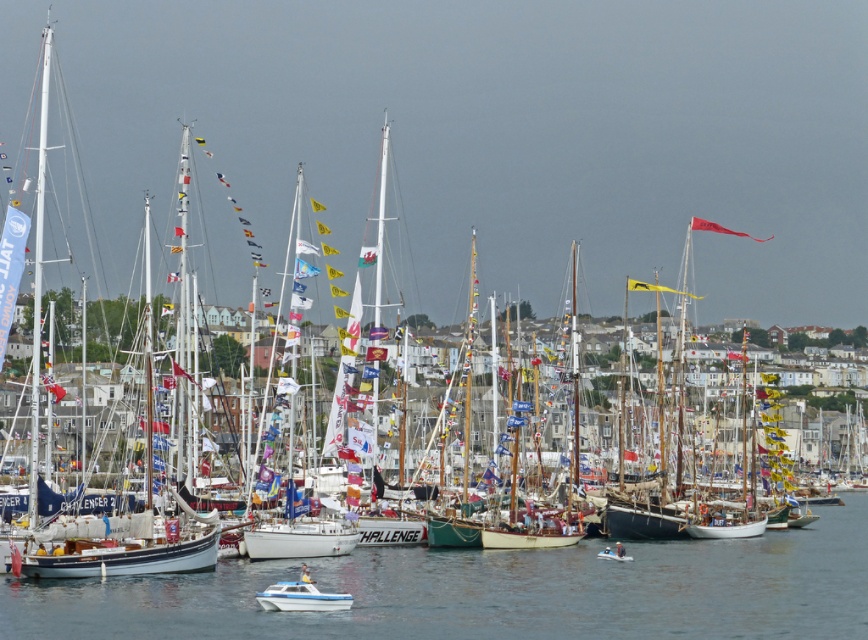
In the scene shown: You are standing at the edge of the marina and see the point at coordinates point [492,593]. Based on the scene, what is the color of the water at that point?

The point [492,593] is on clear blue water at center, so the water at that point is clear blue.

You are a photographer standing at the edge of the marina, wanting to capture the white glossy boat at lower center and the clear blue water at center in your shot. Based on their positions, which object should you focus on first if you want to include both in your frame?

The white glossy boat at lower center should be focused on first since it is positioned to the left of the clear blue water at center, allowing both to be captured in the frame by starting with the boat and panning right towards the water.

You are a photographer planning to capture the white glossy boat at lower center and the clear blue water at center in a wide shot. Given their widths, which one will occupy more horizontal space in the photo?

The clear blue water at center has a greater width than the white glossy boat at lower center, so it will occupy more horizontal space in the photo.